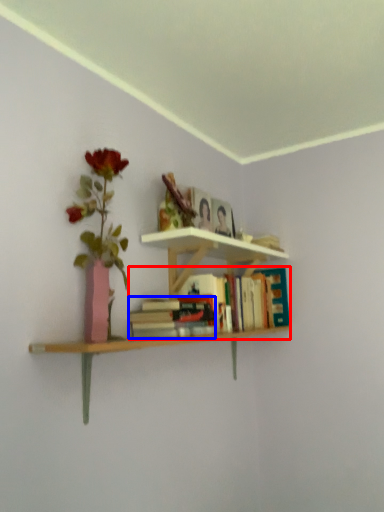
Question: Which point is further to the camera, book (highlighted by a red box) or book (highlighted by a blue box)?

Choices:
 (A) book
 (B) book

Answer: (A)